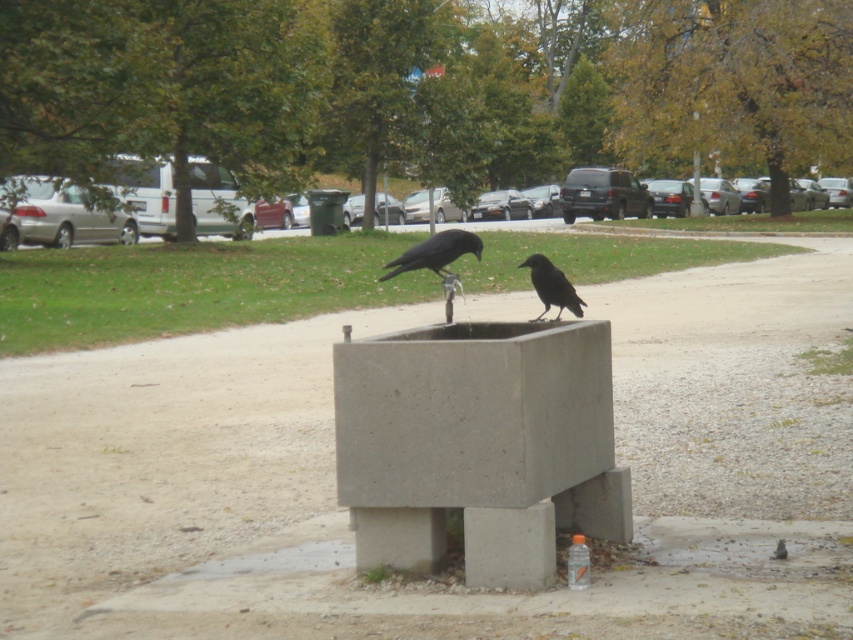
At what (x,y) coordinates should I click in order to perform the action: click on shiny black raven at center. Please return your answer as a coordinate pair (x, y). Looking at the image, I should click on (434, 252).

Is shiny black raven at center positioned behind black matte raven at center?

Yes, shiny black raven at center is behind black matte raven at center.

Describe the element at coordinates (434, 252) in the screenshot. This screenshot has height=640, width=853. I see `shiny black raven at center` at that location.

Identify the location of shiny black raven at center. (434, 252).